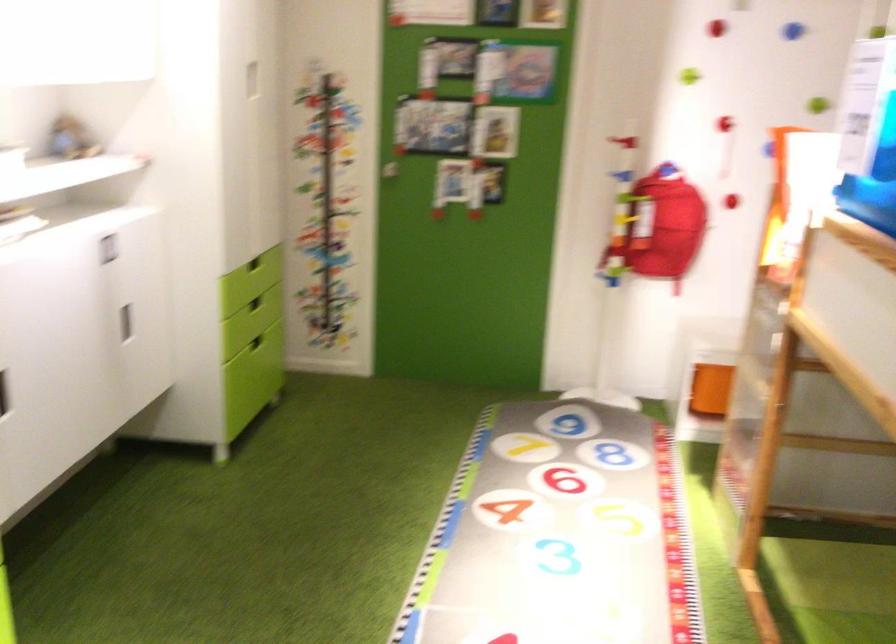
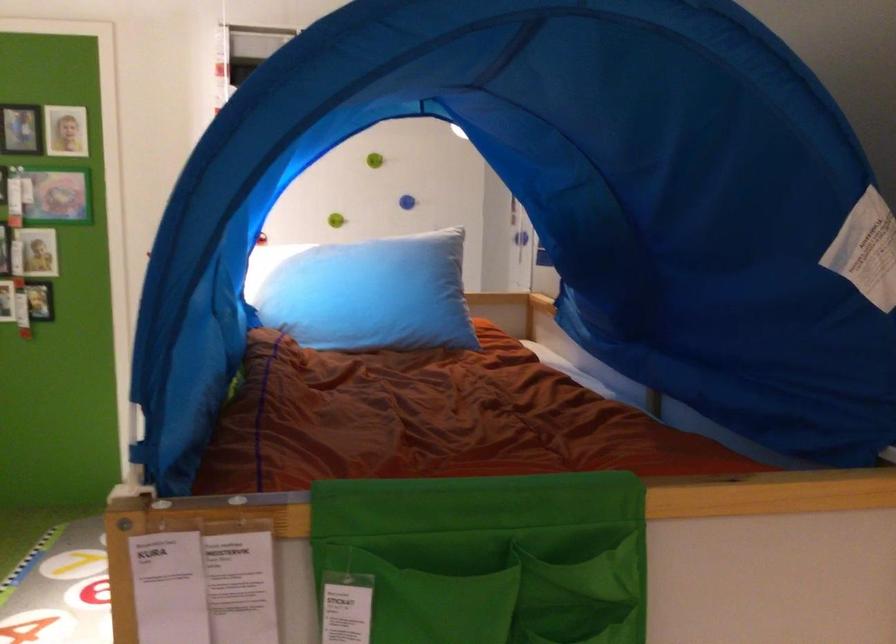
In the second image, find the point that corresponds to pixel 814 79 in the first image.

(334, 220)